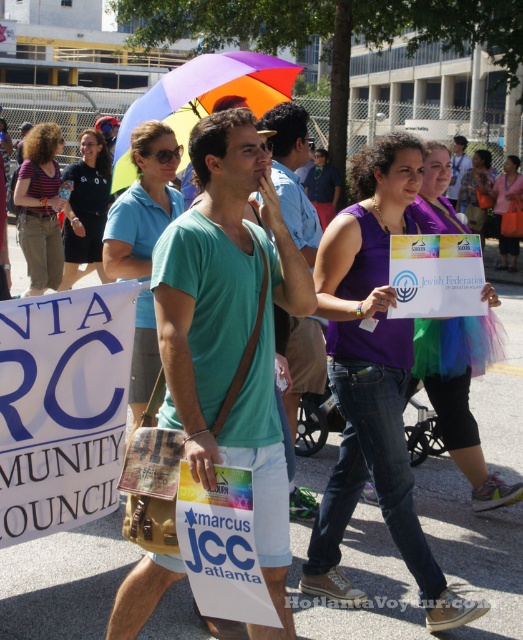
Looking at this image, is teal fabric shirt at center behind matte purple shirt at center?

No, teal fabric shirt at center is closer to the viewer.

Between teal fabric shirt at center and matte purple shirt at center, which one has less height?

teal fabric shirt at center is shorter.

Measure the distance between teal fabric shirt at center and camera.

A distance of 3.04 meters exists between teal fabric shirt at center and camera.

Find the location of a particular element. teal fabric shirt at center is located at coordinates (291, 173).

From the picture: Does teal cotton t-shirt at center appear on the right side of blue paper sign at upper left?

Correct, you'll find teal cotton t-shirt at center to the right of blue paper sign at upper left.

In the scene shown: Can you confirm if teal cotton t-shirt at center is positioned below blue paper sign at upper left?

No.

Describe the element at coordinates (231, 330) in the screenshot. I see `teal cotton t-shirt at center` at that location.

Find the location of a particular element. teal cotton t-shirt at center is located at coordinates (231, 330).

Can you confirm if teal cotton t-shirt at center is thinner than matte purple shirt at center?

Yes.

Is teal cotton t-shirt at center to the right of matte purple shirt at center from the viewer's perspective?

In fact, teal cotton t-shirt at center is to the left of matte purple shirt at center.

Image resolution: width=523 pixels, height=640 pixels. What do you see at coordinates (231, 330) in the screenshot?
I see `teal cotton t-shirt at center` at bounding box center [231, 330].

This screenshot has height=640, width=523. In order to click on teal cotton t-shirt at center in this screenshot , I will do `click(231, 330)`.